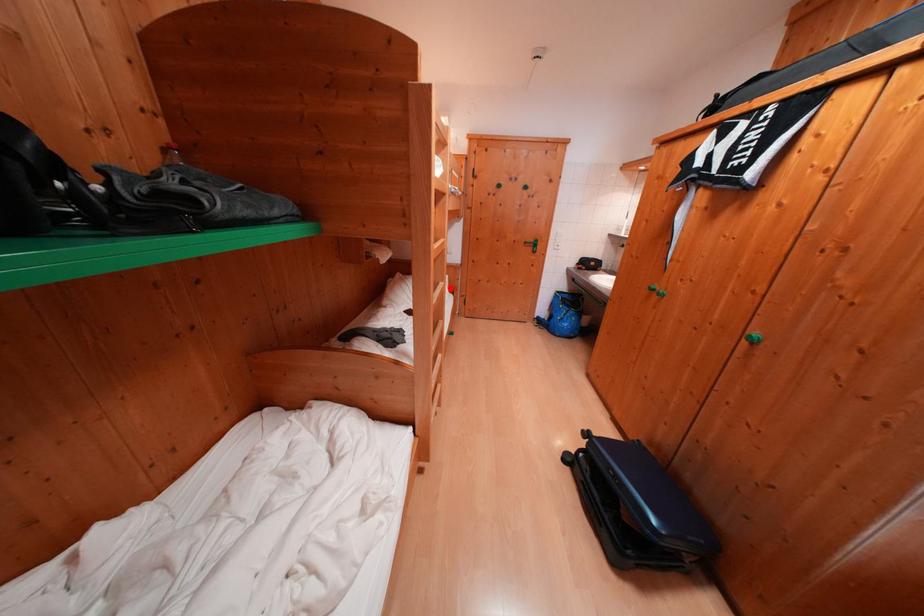
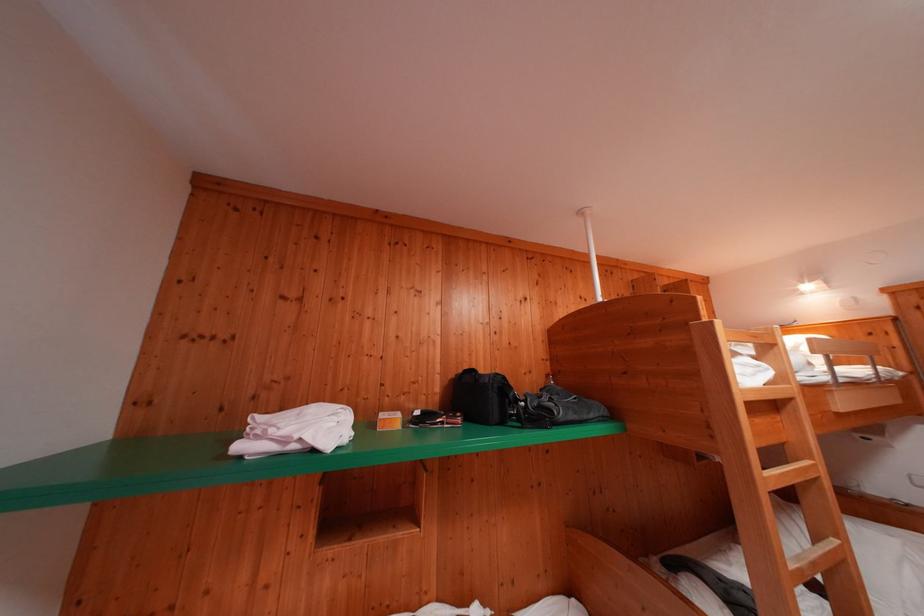
Question: I am providing you with two images of the same scene from different viewpoints. Given a red point in image1, look at the same physical point in image2. Is it:

Choices:
 (A) Closer to the viewpoint
 (B) Farther from the viewpoint

Answer: (A)